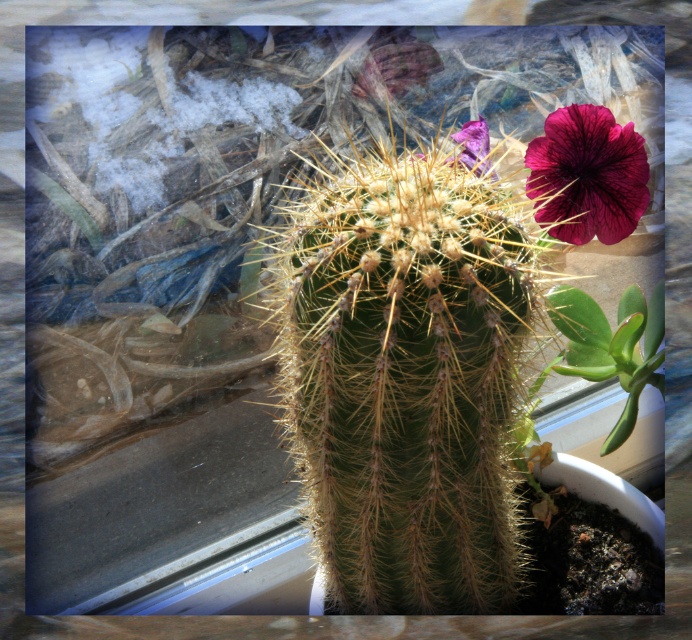
Between dark purple petal at upper right and purple matte flower at upper right, which one has less height?

purple matte flower at upper right is shorter.

This screenshot has height=640, width=692. What do you see at coordinates (588, 176) in the screenshot? I see `dark purple petal at upper right` at bounding box center [588, 176].

Identify the location of dark purple petal at upper right. The height and width of the screenshot is (640, 692). (588, 176).

I want to click on dark purple petal at upper right, so click(588, 176).